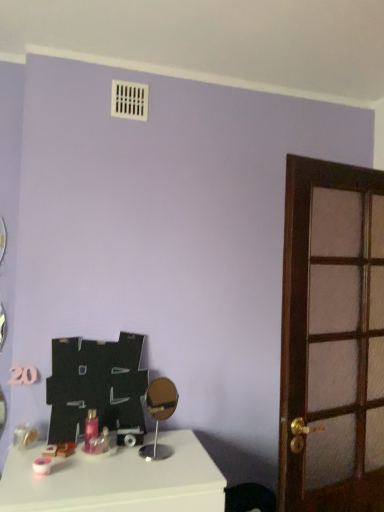
At what (x,y) coordinates should I click in order to perform the action: click on free space to the right of pink glossy bottle at center. Please return your answer as a coordinate pair (x, y). This screenshot has width=384, height=512. Looking at the image, I should click on pyautogui.click(x=144, y=450).